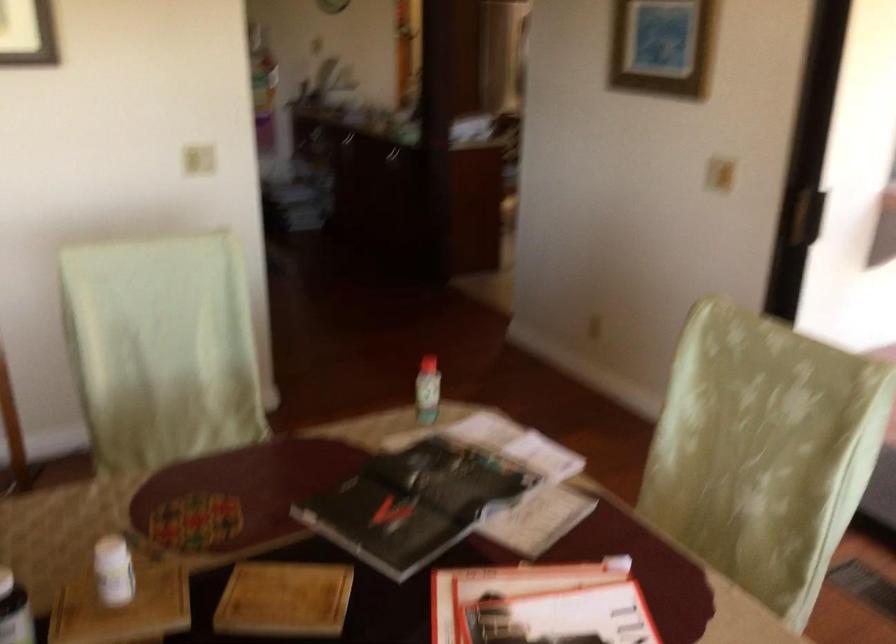
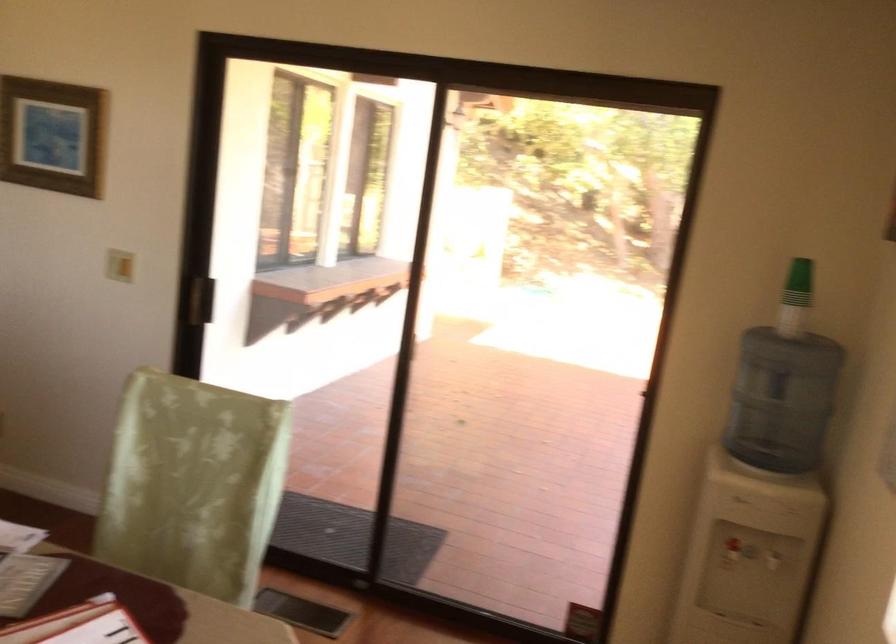
Where in the second image is the point corresponding to [814,219] from the first image?

(201, 299)